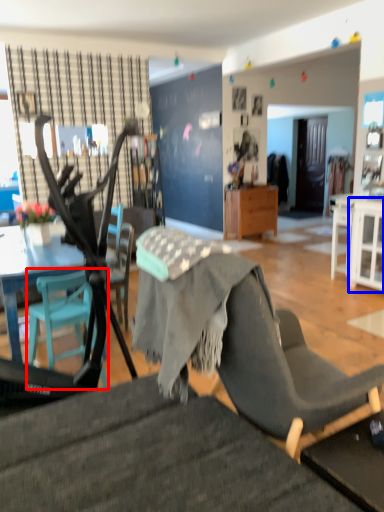
Question: Among these objects, which one is farthest to the camera, chair (highlighted by a red box) or cabinetry (highlighted by a blue box)?

Choices:
 (A) chair
 (B) cabinetry

Answer: (B)